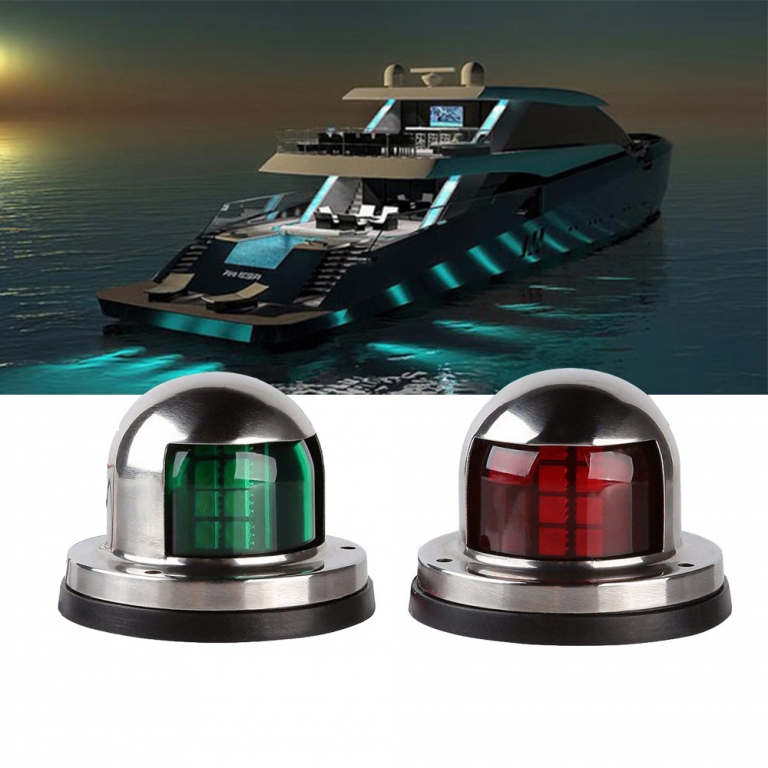
Image resolution: width=768 pixels, height=768 pixels. I want to click on light, so 389,343.